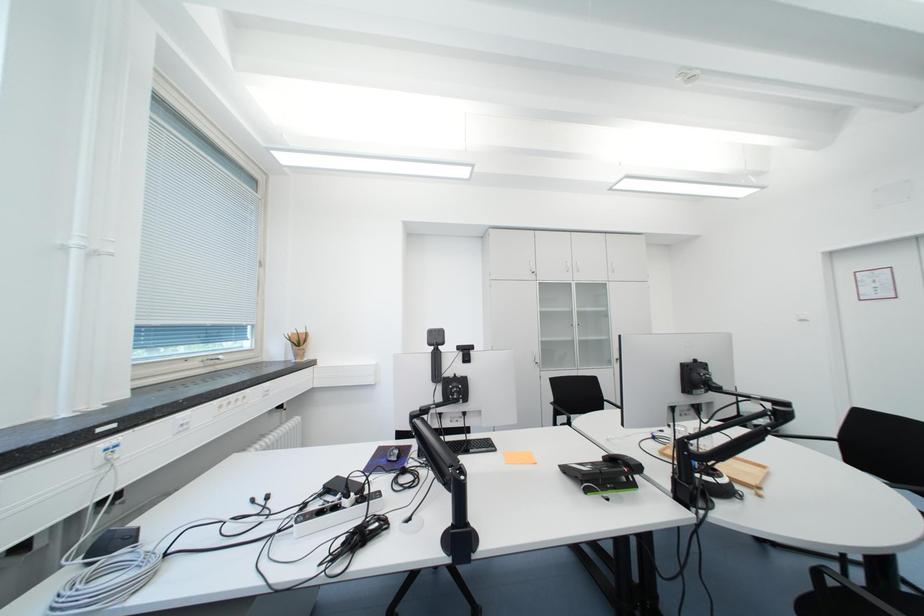
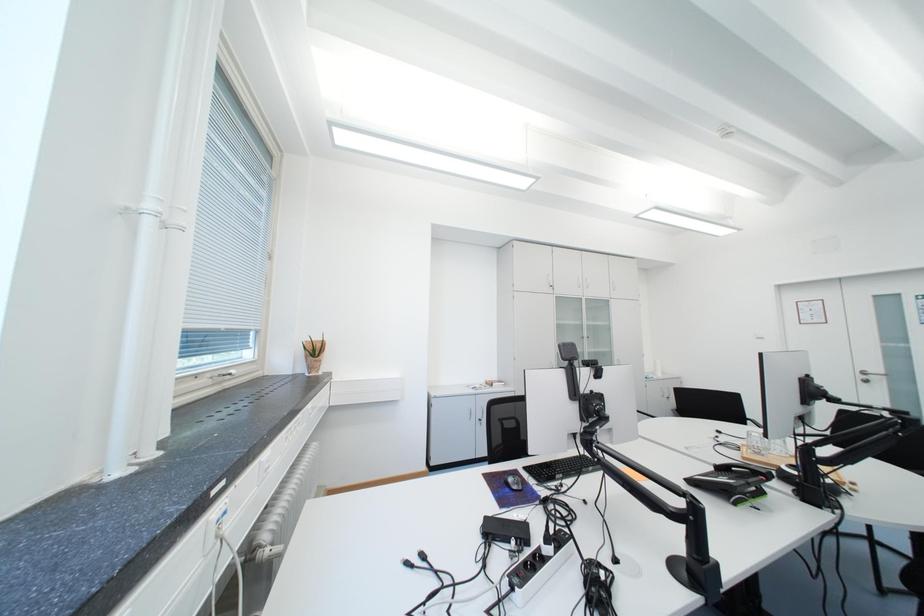
Question: The camera is either moving clockwise (left) or counter-clockwise (right) around the object. The first image is from the beginning of the video and the second image is from the end. Is the camera moving left or right when shooting the video?

Choices:
 (A) Left
 (B) Right

Answer: (A)